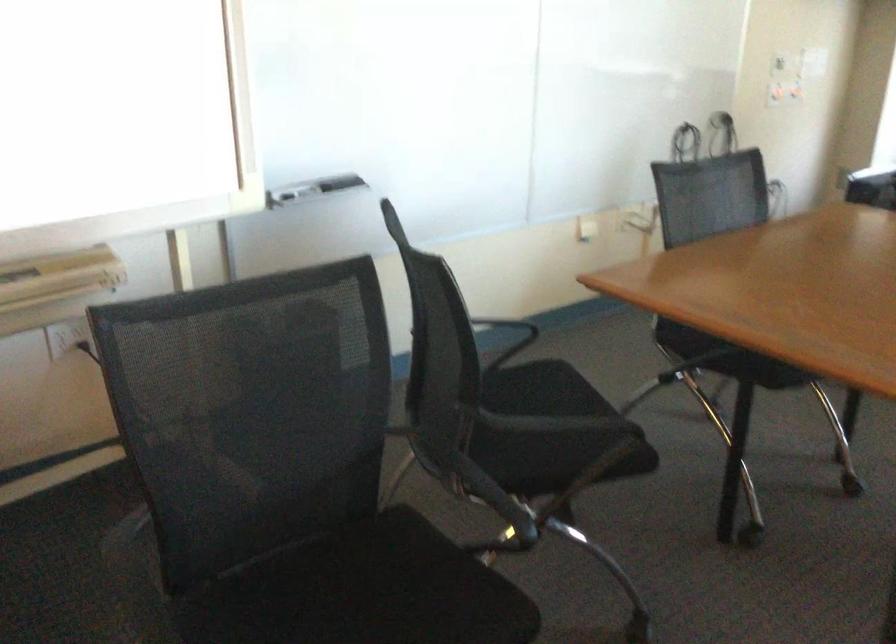
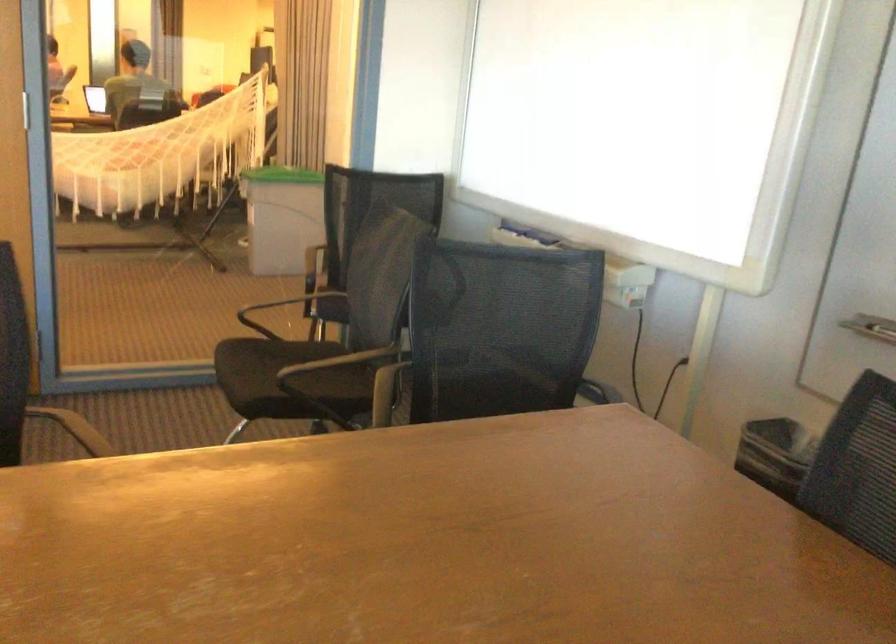
The point at (436,322) is marked in the first image. Where is the corresponding point in the second image?

(501, 328)